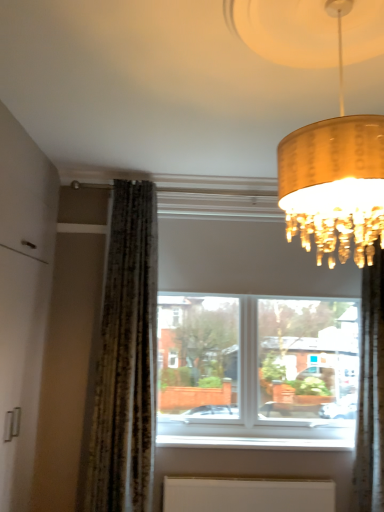
Question: Should I look upward or downward to see gold textured lampshade at upper right?

Choices:
 (A) down
 (B) up

Answer: (B)

Question: From the image's perspective, is silky green curtain at right located beneath gold textured lampshade at upper right?

Choices:
 (A) no
 (B) yes

Answer: (B)

Question: Does silky green curtain at right appear on the left side of gold textured lampshade at upper right?

Choices:
 (A) yes
 (B) no

Answer: (B)

Question: Is silky green curtain at right touching gold textured lampshade at upper right?

Choices:
 (A) yes
 (B) no

Answer: (B)

Question: Is silky green curtain at right at the right side of gold textured lampshade at upper right?

Choices:
 (A) yes
 (B) no

Answer: (A)

Question: Considering the relative positions of silky green curtain at right and gold textured lampshade at upper right in the image provided, is silky green curtain at right in front of gold textured lampshade at upper right?

Choices:
 (A) yes
 (B) no

Answer: (B)

Question: From a real-world perspective, is silky green curtain at right located beneath gold textured lampshade at upper right?

Choices:
 (A) no
 (B) yes

Answer: (B)

Question: Can you confirm if white matte radiator at lower center is smaller than gold textured lampshade at upper right?

Choices:
 (A) yes
 (B) no

Answer: (A)

Question: Is white matte radiator at lower center wider than gold textured lampshade at upper right?

Choices:
 (A) yes
 (B) no

Answer: (B)

Question: Is white matte radiator at lower center next to gold textured lampshade at upper right and touching it?

Choices:
 (A) yes
 (B) no

Answer: (B)

Question: Can you confirm if white matte radiator at lower center is thinner than gold textured lampshade at upper right?

Choices:
 (A) no
 (B) yes

Answer: (B)

Question: Does white matte radiator at lower center appear on the left side of gold textured lampshade at upper right?

Choices:
 (A) yes
 (B) no

Answer: (B)

Question: Does white matte radiator at lower center have a greater height compared to gold textured lampshade at upper right?

Choices:
 (A) no
 (B) yes

Answer: (A)

Question: Is the position of gold textured lampshade at upper right more distant than that of white matte radiator at lower center?

Choices:
 (A) no
 (B) yes

Answer: (A)